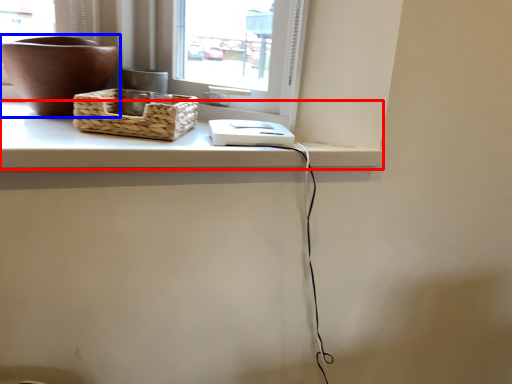
Question: Which point is further to the camera, counter top (highlighted by a red box) or flowerpot (highlighted by a blue box)?

Choices:
 (A) counter top
 (B) flowerpot

Answer: (B)